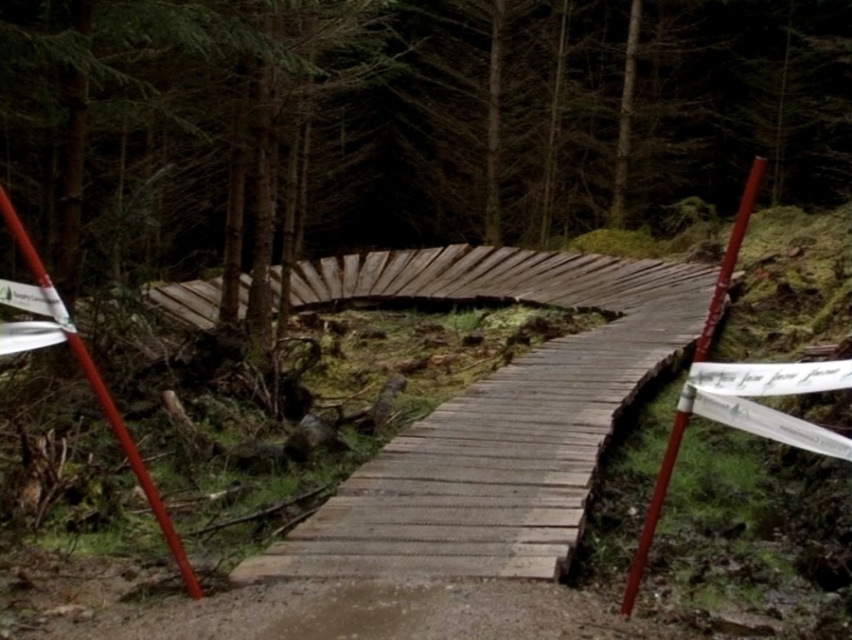
You are standing at the start of the boardwalk and want to reach a specific point marked at coordinates point (398,483). If your walking speed is 3 feet per second, how many seconds will it take you to reach that point?

The distance of point (398,483) from viewer is 16.48 feet. At a speed of 3 feet per second, it will take approximately 5.5 seconds to reach the point. Since 16.48 divided by 3 equals approximately 5.49 seconds, which rounds to 5.5 seconds.

You are a hiker walking along the boardwalk and see the smooth red pole at left and the smooth red pole at right. Which pole is closer to your left side as you face the direction the boardwalk curves?

The smooth red pole at left is closer to your left side as you face the direction the boardwalk curves because it is positioned on the left side of the smooth red pole at right.